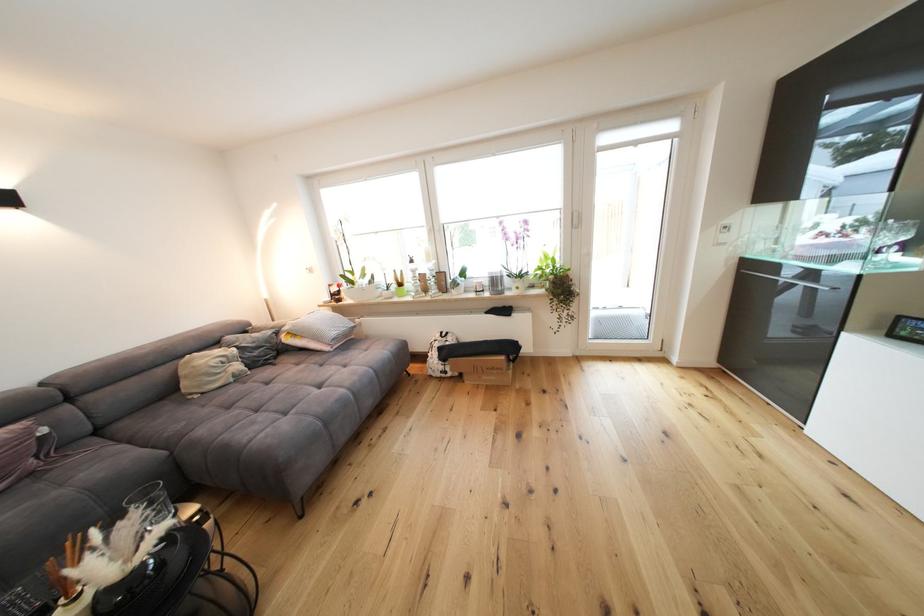
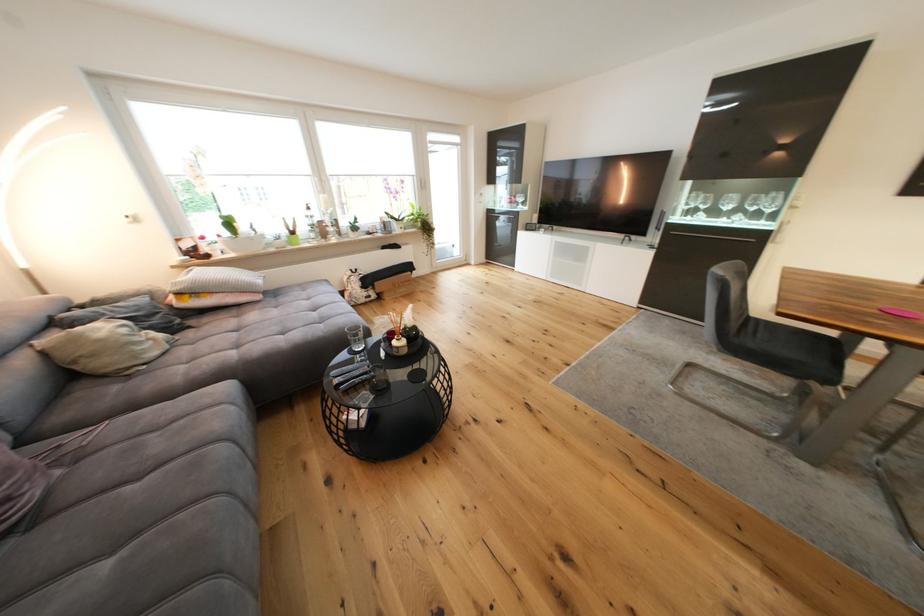
The point at (246, 379) is marked in the first image. Where is the corresponding point in the second image?

(178, 345)